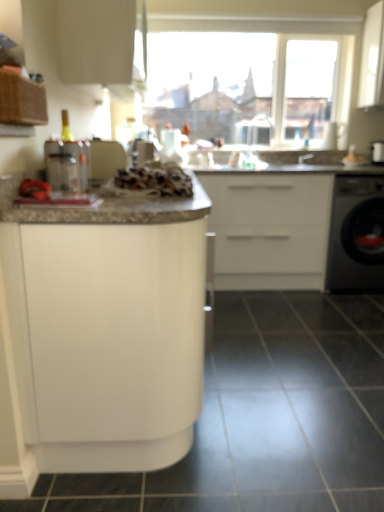
Question: From a real-world perspective, is black glossy tile at lower center physically below clear plastic faucet at upper center, which ranks as the first faucet in left-to-right order?

Choices:
 (A) no
 (B) yes

Answer: (B)

Question: From the image's perspective, does black glossy tile at lower center appear lower than clear plastic faucet at upper center, which ranks as the first faucet in left-to-right order?

Choices:
 (A) yes
 (B) no

Answer: (A)

Question: Does black glossy tile at lower center have a greater height compared to clear plastic faucet at upper center, which ranks as the first faucet in left-to-right order?

Choices:
 (A) yes
 (B) no

Answer: (B)

Question: Is black glossy tile at lower center located outside clear plastic faucet at upper center, positioned as the second faucet in right-to-left order?

Choices:
 (A) yes
 (B) no

Answer: (A)

Question: Is the depth of black glossy tile at lower center greater than that of clear plastic faucet at upper center, which ranks as the first faucet in left-to-right order?

Choices:
 (A) yes
 (B) no

Answer: (B)

Question: Is black glossy tile at lower center taller or shorter than white glossy cabinet at center, which is counted as the 3th cabinetry, starting from the top?

Choices:
 (A) short
 (B) tall

Answer: (A)

Question: Visually, is black glossy tile at lower center positioned to the left or to the right of white glossy cabinet at center, which is the 1th cabinetry in bottom-to-top order?

Choices:
 (A) left
 (B) right

Answer: (B)

Question: Is black glossy tile at lower center bigger or smaller than white glossy cabinet at center, which is the 1th cabinetry in bottom-to-top order?

Choices:
 (A) big
 (B) small

Answer: (B)

Question: From a real-world perspective, is black glossy tile at lower center positioned above or below white glossy cabinet at center, which is counted as the 3th cabinetry, starting from the top?

Choices:
 (A) below
 (B) above

Answer: (A)

Question: Is white glossy cabinet at upper center, which is counted as the 1th cabinetry, starting from the top, in front of or behind black glossy tile at lower center in the image?

Choices:
 (A) behind
 (B) front

Answer: (A)

Question: Does point (72, 59) appear closer or farther from the camera than point (228, 345)?

Choices:
 (A) closer
 (B) farther

Answer: (A)

Question: From a real-world perspective, is white glossy cabinet at upper center, which is counted as the 1th cabinetry, starting from the top, physically located above or below black glossy tile at lower center?

Choices:
 (A) below
 (B) above

Answer: (B)

Question: Considering the positions of white glossy cabinet at upper center, which is counted as the 1th cabinetry, starting from the top, and black glossy tile at lower center in the image, is white glossy cabinet at upper center, which is counted as the 1th cabinetry, starting from the top, taller or shorter than black glossy tile at lower center?

Choices:
 (A) tall
 (B) short

Answer: (A)

Question: Considering the positions of white glossy cabinet at center, which is counted as the 3th cabinetry, starting from the top, and black glossy tile at lower center in the image, is white glossy cabinet at center, which is counted as the 3th cabinetry, starting from the top, taller or shorter than black glossy tile at lower center?

Choices:
 (A) short
 (B) tall

Answer: (B)

Question: From a real-world perspective, relative to black glossy tile at lower center, is white glossy cabinet at center, which is the 1th cabinetry in bottom-to-top order, vertically above or below?

Choices:
 (A) below
 (B) above

Answer: (B)